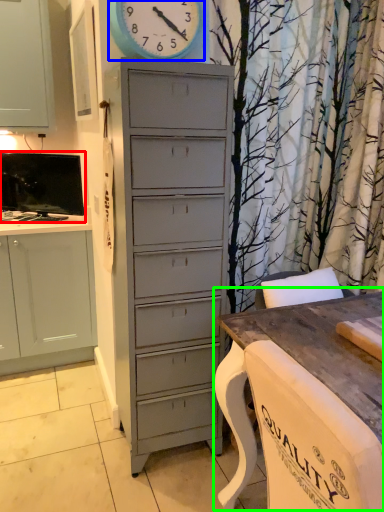
Question: Considering the real-world distances, which object is farthest from television (highlighted by a red box)? clock (highlighted by a blue box) or table (highlighted by a green box)?

Choices:
 (A) clock
 (B) table

Answer: (B)